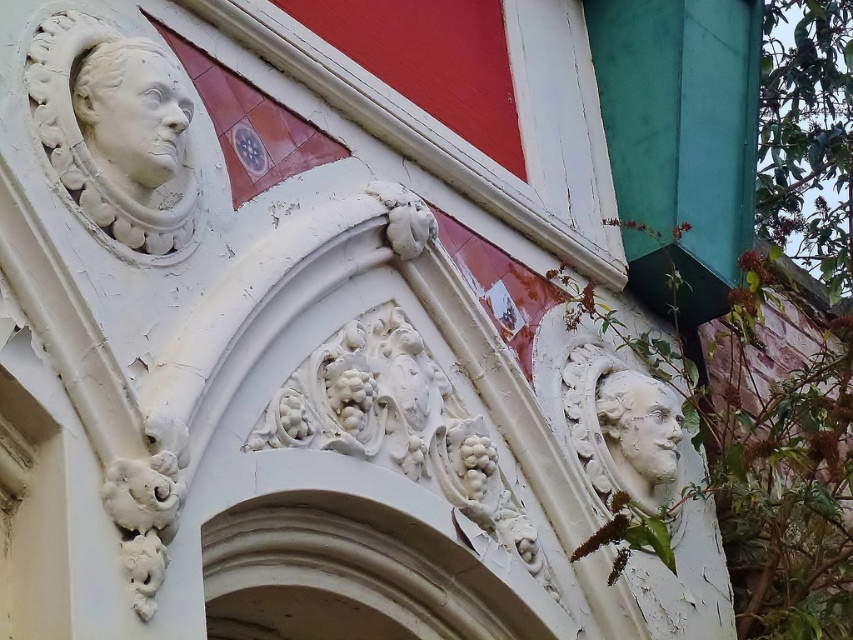
Which is in front, point (76, 115) or point (640, 406)?

Point (76, 115)

The width and height of the screenshot is (853, 640). Find the location of `white plaster face at upper left`. white plaster face at upper left is located at coordinates (138, 115).

Between point (125, 70) and point (647, 422), which one is positioned behind?

The point (647, 422) is behind.

Locate an element on the screen. white plaster face at upper left is located at coordinates [x=138, y=115].